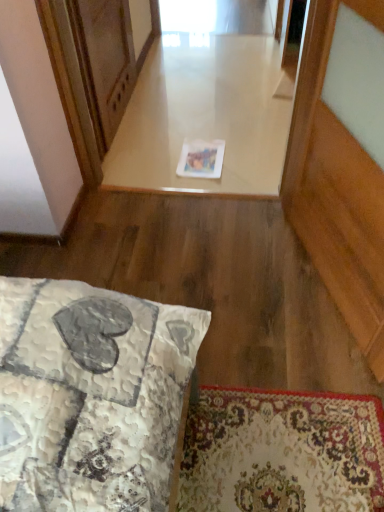
Question: Should I look upward or downward to see wooden screen door at upper left?

Choices:
 (A) up
 (B) down

Answer: (A)

Question: Does wooden screen door at upper left have a lesser height compared to white glossy paper at center?

Choices:
 (A) yes
 (B) no

Answer: (B)

Question: Is the depth of wooden screen door at upper left greater than that of white glossy paper at center?

Choices:
 (A) yes
 (B) no

Answer: (B)

Question: Considering the relative sizes of wooden screen door at upper left and white glossy paper at center in the image provided, is wooden screen door at upper left bigger than white glossy paper at center?

Choices:
 (A) no
 (B) yes

Answer: (A)

Question: Is wooden screen door at upper left at the left side of white glossy paper at center?

Choices:
 (A) yes
 (B) no

Answer: (A)

Question: Can you confirm if wooden screen door at upper left is taller than white glossy paper at center?

Choices:
 (A) yes
 (B) no

Answer: (A)

Question: Is wooden screen door at upper left not close to white glossy paper at center?

Choices:
 (A) no
 (B) yes

Answer: (A)

Question: Are white glossy paper at center and wooden screen door at upper left beside each other?

Choices:
 (A) yes
 (B) no

Answer: (B)

Question: Does white glossy paper at center lie in front of wooden screen door at upper left?

Choices:
 (A) yes
 (B) no

Answer: (B)

Question: Considering the relative sizes of white glossy paper at center and wooden screen door at upper left in the image provided, is white glossy paper at center smaller than wooden screen door at upper left?

Choices:
 (A) no
 (B) yes

Answer: (A)

Question: Is there a large distance between white glossy paper at center and wooden screen door at upper left?

Choices:
 (A) no
 (B) yes

Answer: (A)

Question: From the image's perspective, is white glossy paper at center located beneath wooden screen door at upper left?

Choices:
 (A) yes
 (B) no

Answer: (A)

Question: Is white glossy paper at center completely or partially outside of wooden screen door at upper left?

Choices:
 (A) yes
 (B) no

Answer: (A)

Question: Is white glossy paper at center spatially inside wooden screen door at upper left, or outside of it?

Choices:
 (A) inside
 (B) outside

Answer: (B)